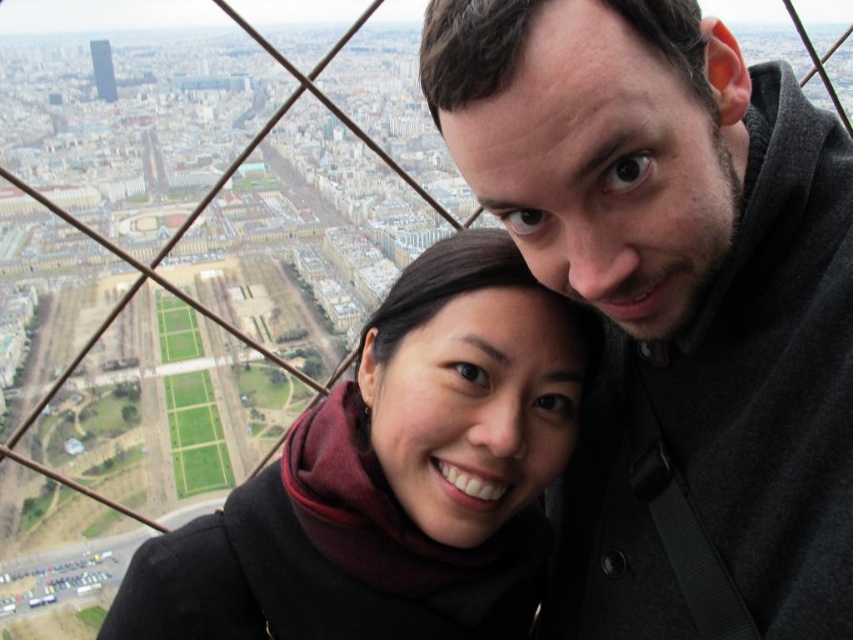
Can you confirm if dark gray sweater at upper right is bigger than black wool scarf at center?

Correct, dark gray sweater at upper right is larger in size than black wool scarf at center.

Based on the photo, how distant is dark gray sweater at upper right from black wool scarf at center?

The distance of dark gray sweater at upper right from black wool scarf at center is 11.18 meters.

Image resolution: width=853 pixels, height=640 pixels. Describe the element at coordinates (672, 304) in the screenshot. I see `dark gray sweater at upper right` at that location.

Find the location of a particular element. dark gray sweater at upper right is located at coordinates (672, 304).